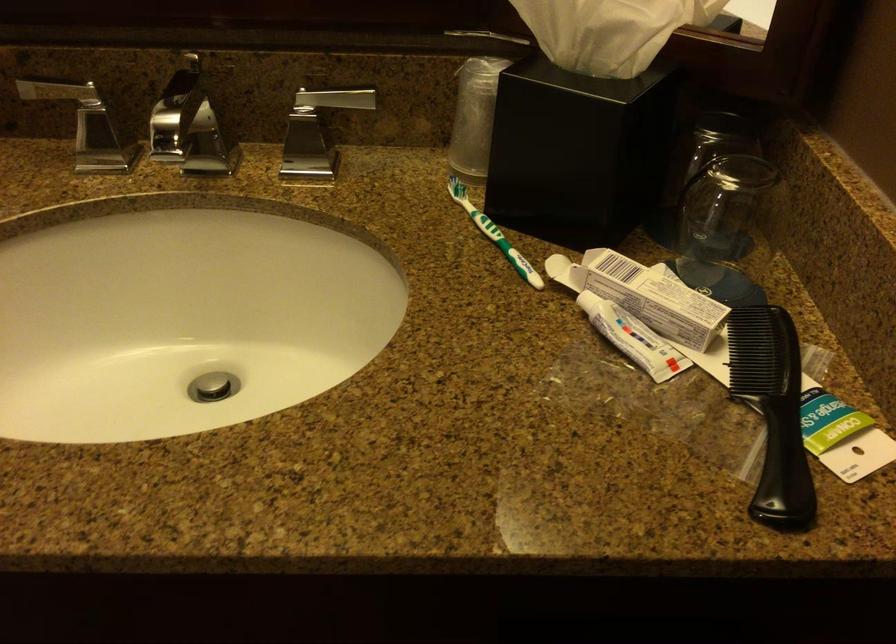
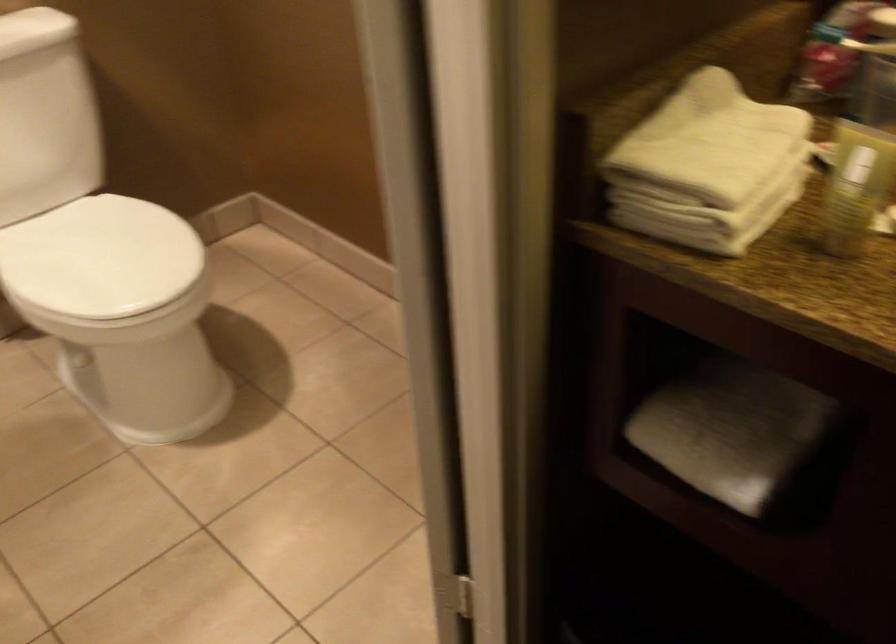
Question: The camera is either moving clockwise (left) or counter-clockwise (right) around the object. The first image is from the beginning of the video and the second image is from the end. Is the camera moving left or right when shooting the video?

Choices:
 (A) Left
 (B) Right

Answer: (B)